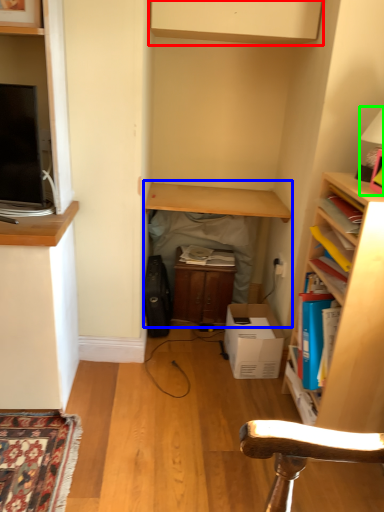
Question: Which object is positioned farthest from cabinetry (highlighted by a red box)? Select from table (highlighted by a blue box) and lamp (highlighted by a green box).

Choices:
 (A) table
 (B) lamp

Answer: (A)